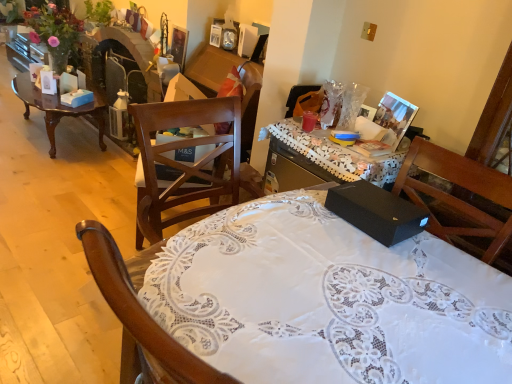
Question: From a real-world perspective, is wooden polished coffee table at left physically located above or below brown wooden chair at center?

Choices:
 (A) below
 (B) above

Answer: (A)

Question: Is wooden polished coffee table at left to the left or to the right of brown wooden chair at center in the image?

Choices:
 (A) right
 (B) left

Answer: (B)

Question: Which is farther from the brown wooden chair at center?

Choices:
 (A) black matte box at center
 (B) black matte box at center
 (C) wooden polished coffee table at left
 (D) matte plastic cup at center

Answer: (C)

Question: Estimate the real-world distances between objects in this image. Which object is closer to the brown wooden chair at center?

Choices:
 (A) black matte box at center
 (B) matte plastic cup at center
 (C) black matte box at center
 (D) wooden polished coffee table at left

Answer: (C)